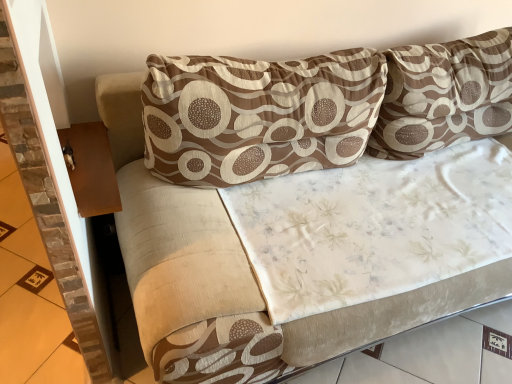
Question: Is brown wood table at left shorter than brown textured pillow at center, marked as the 2th pillow in a right-to-left arrangement?

Choices:
 (A) no
 (B) yes

Answer: (B)

Question: Does brown wood table at left lie behind brown textured pillow at center, marked as the 2th pillow in a right-to-left arrangement?

Choices:
 (A) yes
 (B) no

Answer: (A)

Question: Is brown wood table at left taller than brown textured pillow at center, marked as the 2th pillow in a right-to-left arrangement?

Choices:
 (A) no
 (B) yes

Answer: (A)

Question: Are brown wood table at left and brown textured pillow at center, marked as the 2th pillow in a right-to-left arrangement, beside each other?

Choices:
 (A) no
 (B) yes

Answer: (A)

Question: Is brown wood table at left turned away from brown textured pillow at center, positioned as the first pillow in left-to-right order?

Choices:
 (A) no
 (B) yes

Answer: (A)

Question: Based on their sizes in the image, would you say brown textured pillow at upper right, the first pillow when ordered from right to left, is bigger or smaller than brown textured pillow at center, marked as the 2th pillow in a right-to-left arrangement?

Choices:
 (A) small
 (B) big

Answer: (B)

Question: Is brown textured pillow at upper right, the first pillow when ordered from right to left, taller or shorter than brown textured pillow at center, marked as the 2th pillow in a right-to-left arrangement?

Choices:
 (A) tall
 (B) short

Answer: (A)

Question: From a real-world perspective, is brown textured pillow at upper right, acting as the second pillow starting from the left, above or below brown textured pillow at center, positioned as the first pillow in left-to-right order?

Choices:
 (A) below
 (B) above

Answer: (B)

Question: Would you say brown textured pillow at upper right, the first pillow when ordered from right to left, is to the left or to the right of brown textured pillow at center, positioned as the first pillow in left-to-right order, in the picture?

Choices:
 (A) left
 (B) right

Answer: (B)

Question: Considering the positions of point (100, 173) and point (19, 261), is point (100, 173) closer or farther from the camera than point (19, 261)?

Choices:
 (A) closer
 (B) farther

Answer: (A)

Question: Considering the positions of brown wood table at left and brown stone tile at left in the image, is brown wood table at left taller or shorter than brown stone tile at left?

Choices:
 (A) short
 (B) tall

Answer: (A)

Question: From a real-world perspective, is brown wood table at left above or below brown stone tile at left?

Choices:
 (A) below
 (B) above

Answer: (B)

Question: In the image, is brown wood table at left positioned in front of or behind brown stone tile at left?

Choices:
 (A) front
 (B) behind

Answer: (A)

Question: Considering the positions of brown stone tile at left and brown textured pillow at center, marked as the 2th pillow in a right-to-left arrangement, in the image, is brown stone tile at left taller or shorter than brown textured pillow at center, marked as the 2th pillow in a right-to-left arrangement,?

Choices:
 (A) short
 (B) tall

Answer: (A)

Question: Would you say brown stone tile at left is to the left or to the right of brown textured pillow at center, marked as the 2th pillow in a right-to-left arrangement, in the picture?

Choices:
 (A) left
 (B) right

Answer: (A)